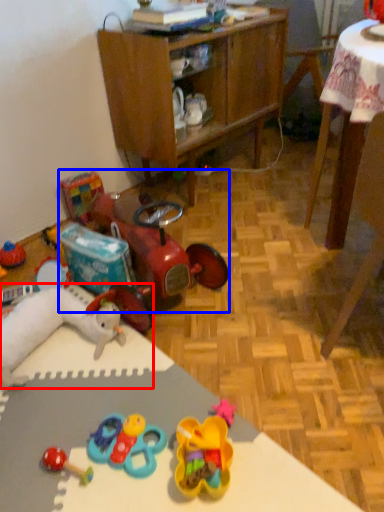
Question: Which object is closer to the camera taking this photo, toy (highlighted by a red box) or toy (highlighted by a blue box)?

Choices:
 (A) toy
 (B) toy

Answer: (A)